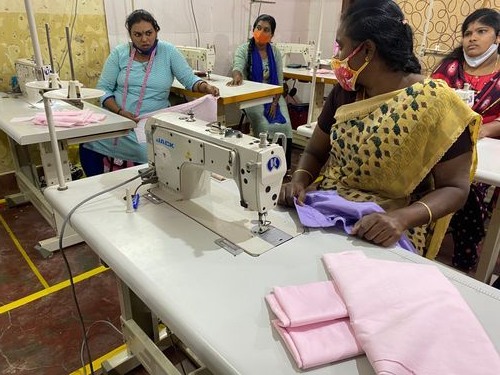
What are the coordinates of `white tables` in the screenshot? It's located at (234, 308), (18, 110), (246, 88), (491, 163).